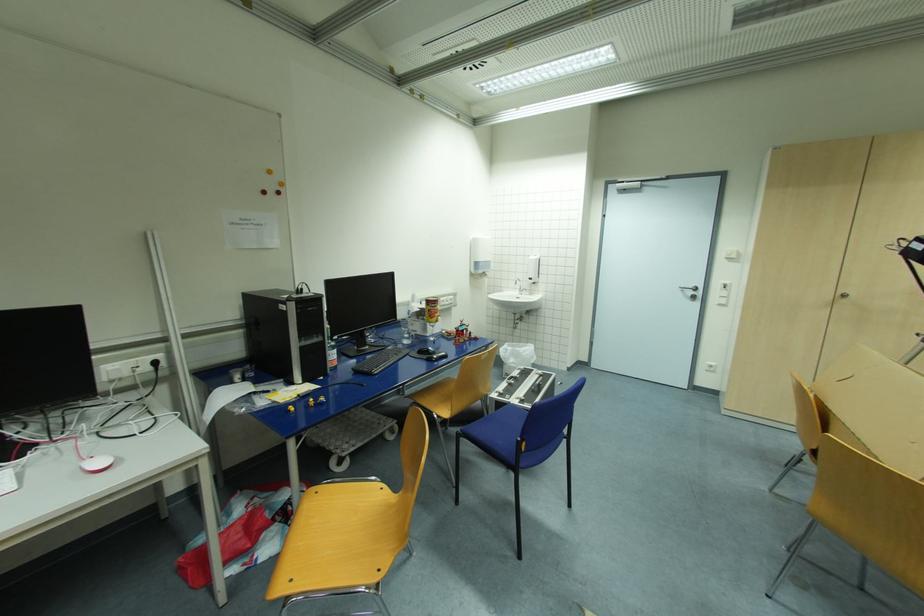
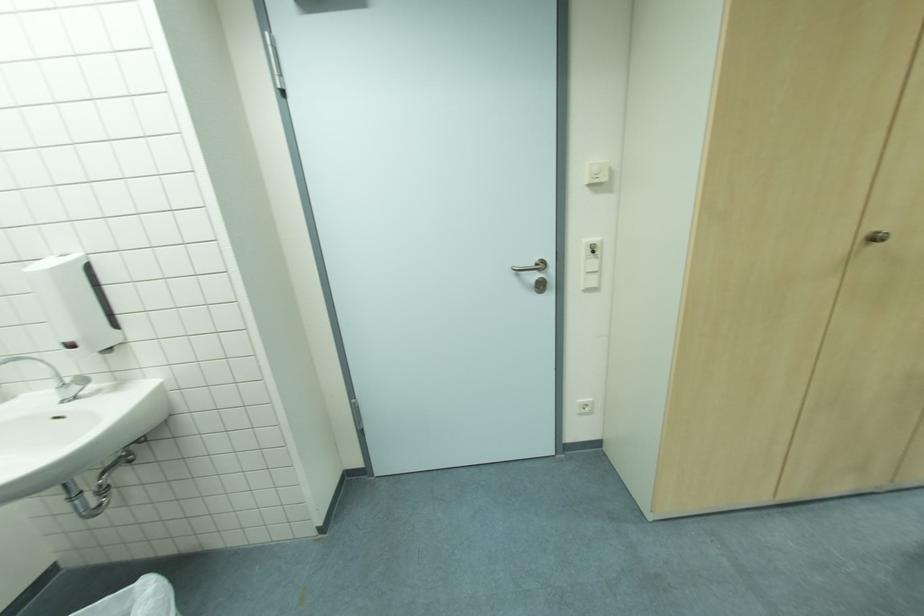
Where in the second image is the point corresponding to point (725, 302) from the first image?

(598, 285)